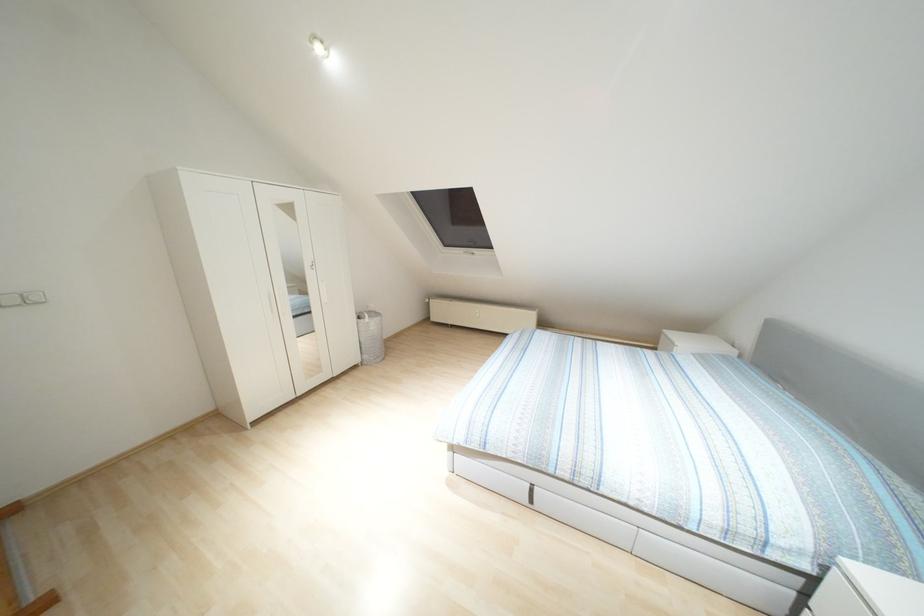
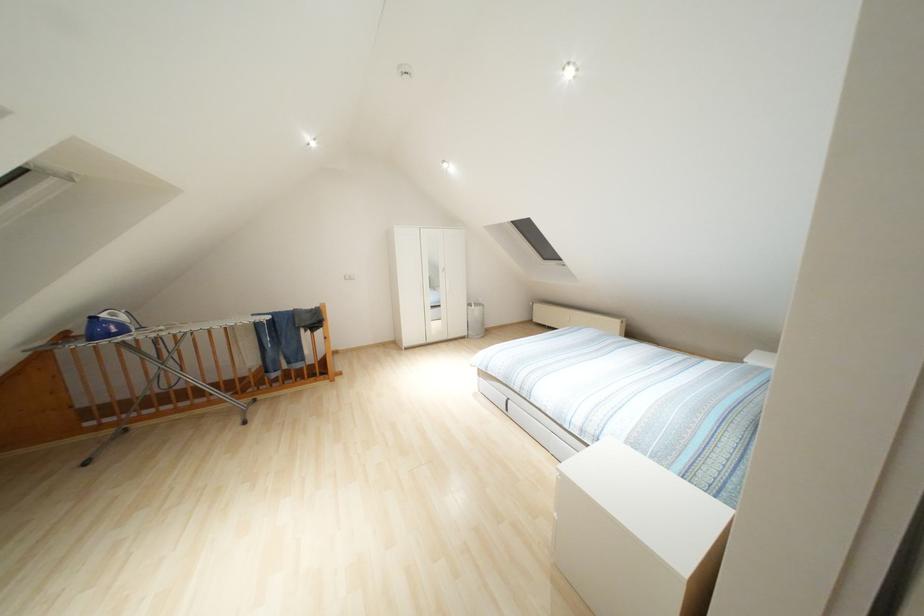
Where in the second image is the point corresponding to point 371,323 from the first image?

(476, 310)